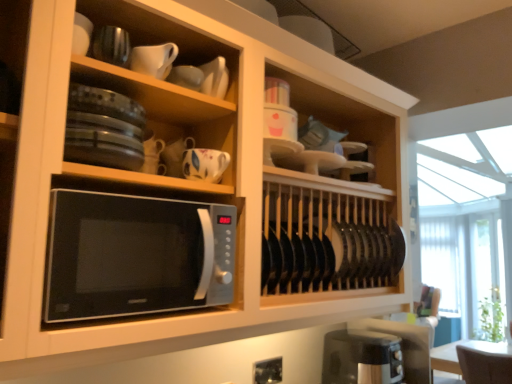
Question: Does black plastic toaster at lower right have a smaller size compared to white matte pitcher at upper center, which is counted as the 1th tableware, starting from the top?

Choices:
 (A) yes
 (B) no

Answer: (B)

Question: Is white matte pitcher at upper center, which is counted as the 1th tableware, starting from the top, a part of black plastic toaster at lower right?

Choices:
 (A) no
 (B) yes

Answer: (A)

Question: Considering the relative sizes of black plastic toaster at lower right and white matte pitcher at upper center, which ranks as the 4th tableware in bottom-to-top order, in the image provided, is black plastic toaster at lower right thinner than white matte pitcher at upper center, which ranks as the 4th tableware in bottom-to-top order,?

Choices:
 (A) yes
 (B) no

Answer: (B)

Question: Is black plastic toaster at lower right at the left side of white matte pitcher at upper center, which ranks as the 4th tableware in bottom-to-top order?

Choices:
 (A) no
 (B) yes

Answer: (A)

Question: Is black plastic toaster at lower right positioned behind white matte pitcher at upper center, which ranks as the 4th tableware in bottom-to-top order?

Choices:
 (A) yes
 (B) no

Answer: (A)

Question: Considering the positions of white glossy cup at upper center, marked as the third tableware in a bottom-to-top arrangement, and matte white cup at upper center, the third tableware from the top, in the image, is white glossy cup at upper center, marked as the third tableware in a bottom-to-top arrangement, bigger or smaller than matte white cup at upper center, the third tableware from the top,?

Choices:
 (A) small
 (B) big

Answer: (B)

Question: Do you think white glossy cup at upper center, marked as the third tableware in a bottom-to-top arrangement, is within matte white cup at upper center, the third tableware from the top, or outside of it?

Choices:
 (A) inside
 (B) outside

Answer: (B)

Question: From their relative heights in the image, would you say white glossy cup at upper center, the 2th tableware from the top, is taller or shorter than matte white cup at upper center, the third tableware from the top?

Choices:
 (A) tall
 (B) short

Answer: (A)

Question: Is white glossy cup at upper center, marked as the third tableware in a bottom-to-top arrangement, wider or thinner than matte white cup at upper center, the third tableware from the top?

Choices:
 (A) thin
 (B) wide

Answer: (B)

Question: Does point (169, 51) appear closer or farther from the camera than point (108, 271)?

Choices:
 (A) closer
 (B) farther

Answer: (B)

Question: From the image's perspective, is white matte pitcher at upper center, which is counted as the 1th tableware, starting from the top, located above or below sleek silver microwave at center?

Choices:
 (A) above
 (B) below

Answer: (A)

Question: Based on their positions, is white matte pitcher at upper center, which ranks as the 4th tableware in bottom-to-top order, located to the left or right of sleek silver microwave at center?

Choices:
 (A) left
 (B) right

Answer: (B)

Question: Is white matte pitcher at upper center, which ranks as the 4th tableware in bottom-to-top order, in front of or behind sleek silver microwave at center in the image?

Choices:
 (A) front
 (B) behind

Answer: (B)

Question: From a real-world perspective, is glossy ceramic mug at upper center, which is counted as the fourth tableware, starting from the top, physically located above or below white glossy cup at upper center, the 2th tableware from the top?

Choices:
 (A) above
 (B) below

Answer: (B)

Question: In terms of width, does glossy ceramic mug at upper center, which is counted as the fourth tableware, starting from the top, look wider or thinner when compared to white glossy cup at upper center, marked as the third tableware in a bottom-to-top arrangement?

Choices:
 (A) wide
 (B) thin

Answer: (A)